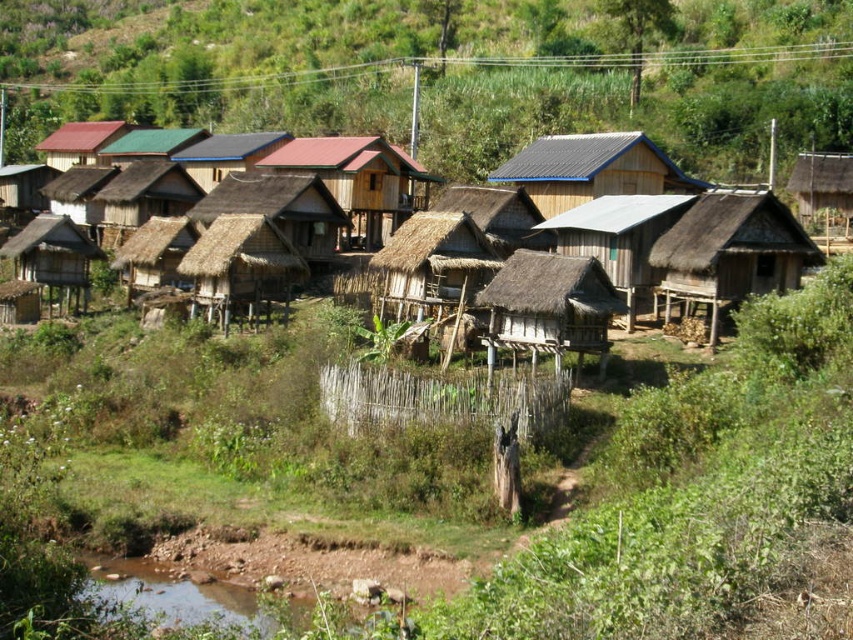
You are standing at the origin point of the village map. Where exactly are the thatched wood houses at center located?

The thatched wood houses at center are located at point (669, 221).

You are a visitor in the village and want to know which house has more space inside. Based on the roofs, which one would you choose between the thatched wood houses at center and the smooth dark blue roof at center?

The thatched wood houses at center is larger in size than smooth dark blue roof at center, so it likely has more space inside.

You are a traveler who wants to visit both the brown thatch hut at upper right and the matte brown thatched hut at upper left. Which one is closer to the stream?

The brown thatch hut at upper right is closer to the stream because it has a smaller size compared to the matte brown thatched hut at upper left.